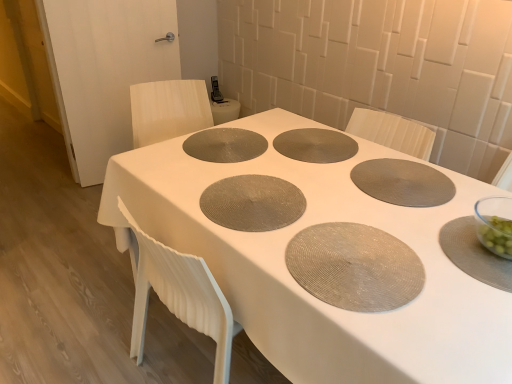
Question: Is matte gray placemat at center, the second oval in the bottom-to-top sequence, further to the viewer compared to matte gray placemat at center, positioned as the second pizza pan in right-to-left order?

Choices:
 (A) yes
 (B) no

Answer: (B)

Question: Can you confirm if matte gray placemat at center, the 1th oval from the top, is positioned to the right of matte gray placemat at center, positioned as the second pizza pan in right-to-left order?

Choices:
 (A) yes
 (B) no

Answer: (B)

Question: From a real-world perspective, is matte gray placemat at center, which is counted as the second oval, starting from the right, beneath matte gray placemat at center, positioned as the second pizza pan in right-to-left order?

Choices:
 (A) no
 (B) yes

Answer: (B)

Question: Can you confirm if matte gray placemat at center, marked as the 1th oval in a back-to-front arrangement, is thinner than matte gray placemat at center, positioned as the second pizza pan in right-to-left order?

Choices:
 (A) yes
 (B) no

Answer: (A)

Question: Can you confirm if matte gray placemat at center, acting as the first oval starting from the left, is positioned to the left of matte gray placemat at center, positioned as the second pizza pan in right-to-left order?

Choices:
 (A) yes
 (B) no

Answer: (A)

Question: Can you confirm if matte gray placemat at center, which is counted as the second oval, starting from the right, is shorter than matte gray placemat at center, the 2th pizza pan when ordered from left to right?

Choices:
 (A) yes
 (B) no

Answer: (A)

Question: Does matte gray placemat at center, the 2th pizza pan when ordered from left to right, come in front of matte gray placemat at center, positioned as the 3th pizza pan in right-to-left order?

Choices:
 (A) no
 (B) yes

Answer: (A)

Question: From the image's perspective, would you say matte gray placemat at center, positioned as the second pizza pan in right-to-left order, is shown under matte gray placemat at center, acting as the first pizza pan starting from the left?

Choices:
 (A) no
 (B) yes

Answer: (A)

Question: Is matte gray placemat at center, the 2th pizza pan when ordered from left to right, shorter than matte gray placemat at center, acting as the first pizza pan starting from the left?

Choices:
 (A) yes
 (B) no

Answer: (A)

Question: Can you confirm if matte gray placemat at center, positioned as the second pizza pan in right-to-left order, is positioned to the right of matte gray placemat at center, positioned as the 3th pizza pan in right-to-left order?

Choices:
 (A) no
 (B) yes

Answer: (B)

Question: Is matte gray placemat at center, positioned as the 3th pizza pan in right-to-left order, at the back of matte gray placemat at center, the 2th pizza pan when ordered from left to right?

Choices:
 (A) yes
 (B) no

Answer: (A)

Question: From a real-world perspective, is matte gray placemat at center, the 2th pizza pan when ordered from left to right, under matte gray placemat at center, acting as the first pizza pan starting from the left?

Choices:
 (A) no
 (B) yes

Answer: (B)

Question: Are matte gray placemat at center, the 2th pizza pan when ordered from left to right, and matte gray placemat at center located far from each other?

Choices:
 (A) no
 (B) yes

Answer: (A)